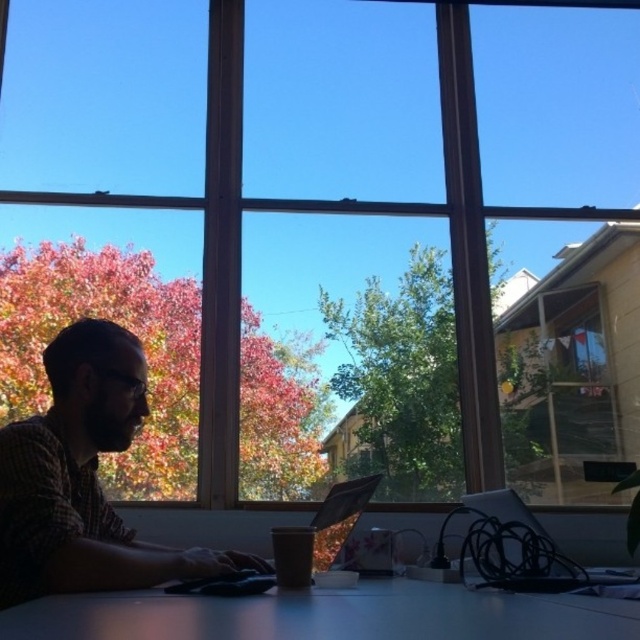
You are a delivery person trying to place a package on the desk. The package is taller than the white glossy table at center. Can you place the package on the desk without it blocking the view of the matte plaid shirt at left?

The matte plaid shirt at left is much taller than the white glossy table at center. Since the package is taller than the white glossy table at center, it would likely block the view of the matte plaid shirt at left if placed on the desk.

You are standing in the room and want to place a new plant pot between the matte plaid shirt at left and the white glossy table at center. Can you fit it there?

The matte plaid shirt at left is to the left of the white glossy table at center, so there is space between them to place the plant pot.

You are a delivery person who needs to place a small package on the white glossy table at center without blocking the metallic silver laptop at center. Can you fit the package there?

The white glossy table at center is taller than the metallic silver laptop at center, so yes, the package can be placed on the white glossy table at center without blocking the laptop since the table is higher.